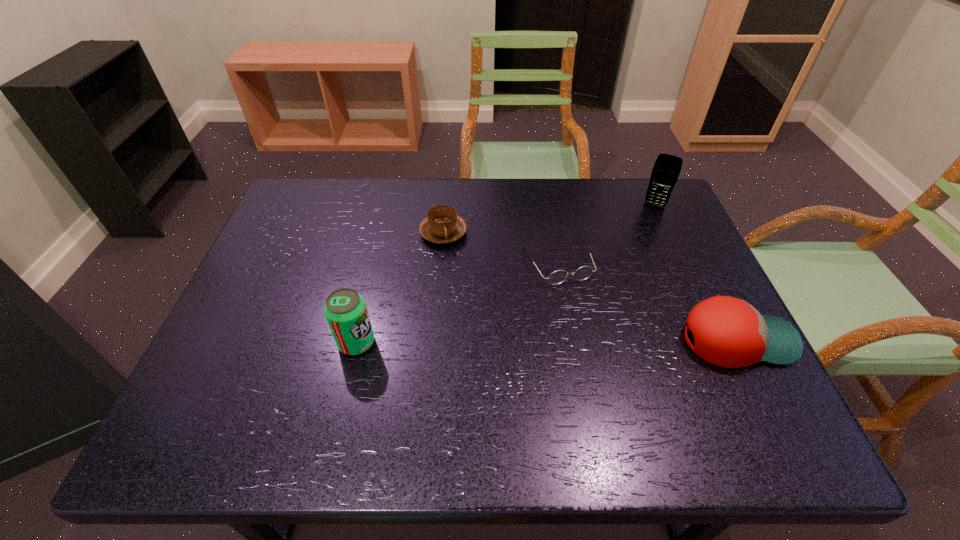
Locate an element on the screen. The height and width of the screenshot is (540, 960). the leftmost object is located at coordinates (345, 310).

This screenshot has height=540, width=960. Find the location of `pop soda`. pop soda is located at coordinates (345, 310).

Identify the location of baseball cap. (728, 332).

Image resolution: width=960 pixels, height=540 pixels. In order to click on the fourth object from right to left in this screenshot , I will do `click(442, 225)`.

The height and width of the screenshot is (540, 960). I want to click on cappuccino, so click(442, 225).

I want to click on the farthest object, so click(666, 170).

Find the location of a particular element. The image size is (960, 540). the shortest object is located at coordinates (559, 276).

The height and width of the screenshot is (540, 960). I want to click on spectacles, so click(559, 276).

This screenshot has width=960, height=540. Identify the location of vacant area situated on the front-facing side of the fourth shortest object. coord(468,342).

This screenshot has width=960, height=540. I want to click on vacant space located 0.280m on the side of the second object from left to right with the handle, so click(x=514, y=312).